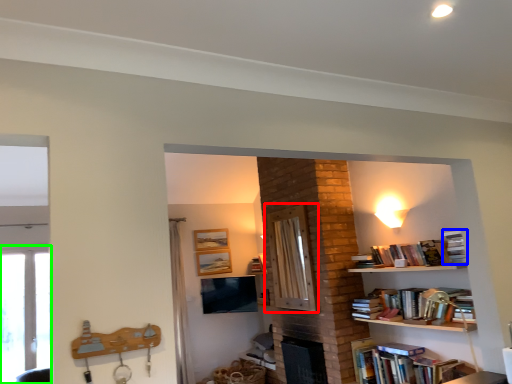
Question: Which object is the farthest from screen door (highlighted by a red box)? Choose among these: book (highlighted by a blue box) or window (highlighted by a green box).

Choices:
 (A) book
 (B) window

Answer: (B)